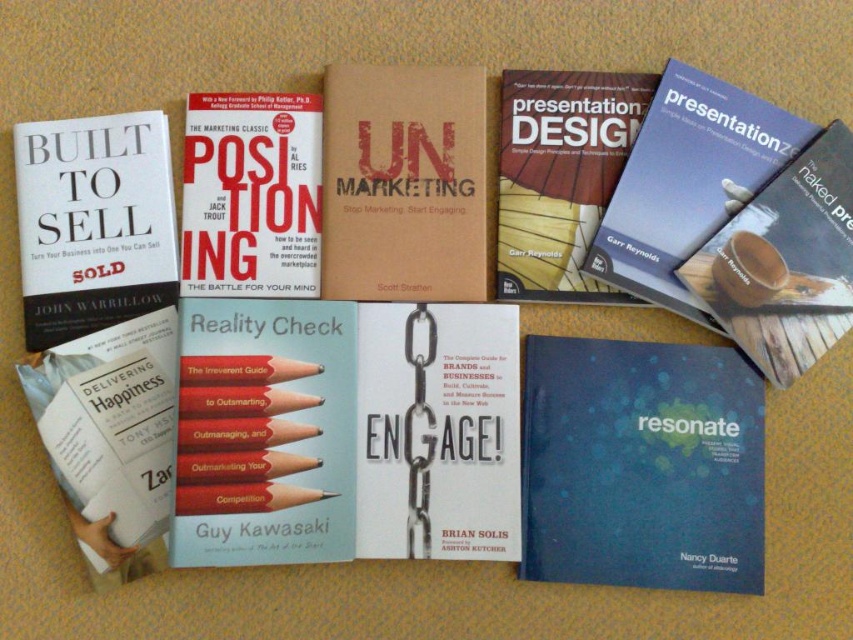
Question: Which point is farther to the camera?

Choices:
 (A) (71, 182)
 (B) (651, 99)
 (C) (724, 420)
 (D) (636, 116)

Answer: (D)

Question: Does brown matte/uncoated book at center appear under matte blue book at center?

Choices:
 (A) yes
 (B) no

Answer: (B)

Question: Which point is closer to the camera?

Choices:
 (A) blue pencil at center
 (B) matte paper presentation design book at center
 (C) blue matte presentation book at upper right

Answer: (A)

Question: Can you confirm if blue pencil at center is bigger than matte paper book at upper left?

Choices:
 (A) yes
 (B) no

Answer: (A)

Question: Does brown matte/uncoated book at center appear under blue matte presentation book at upper right?

Choices:
 (A) no
 (B) yes

Answer: (A)

Question: Which point is farther to the camera?

Choices:
 (A) matte paper presentation design book at center
 (B) matte paper book at upper left

Answer: (A)